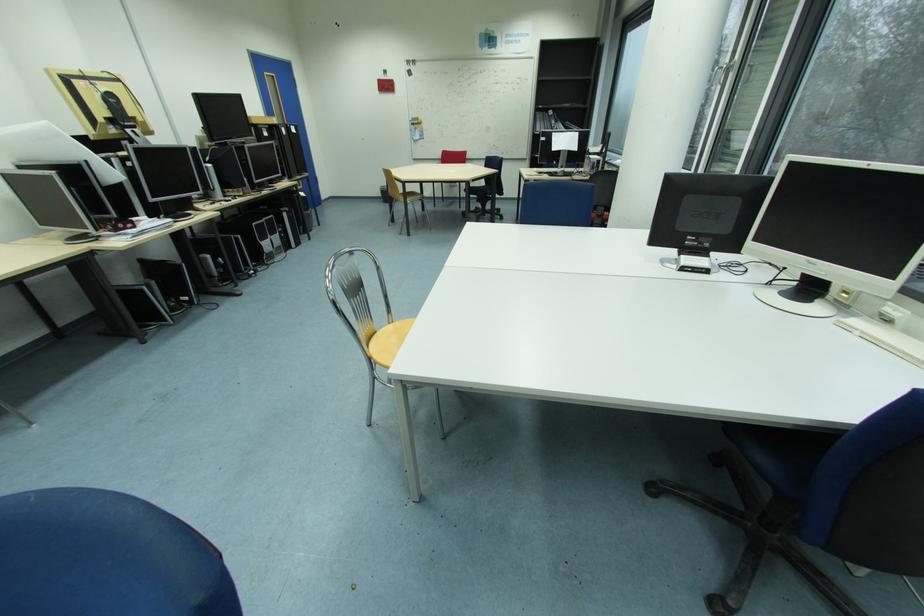
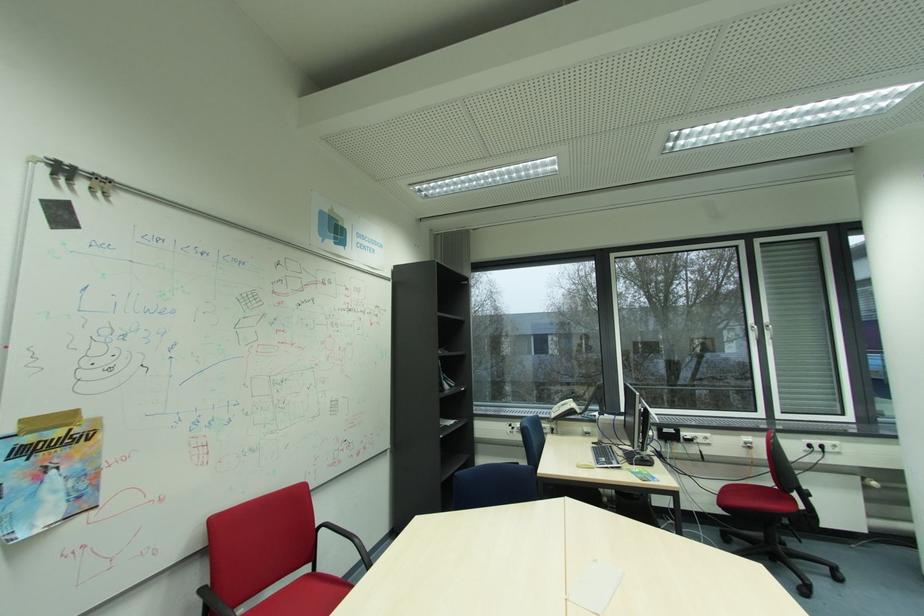
The point at [420,126] is marked in the first image. Where is the corresponding point in the second image?

(31, 452)